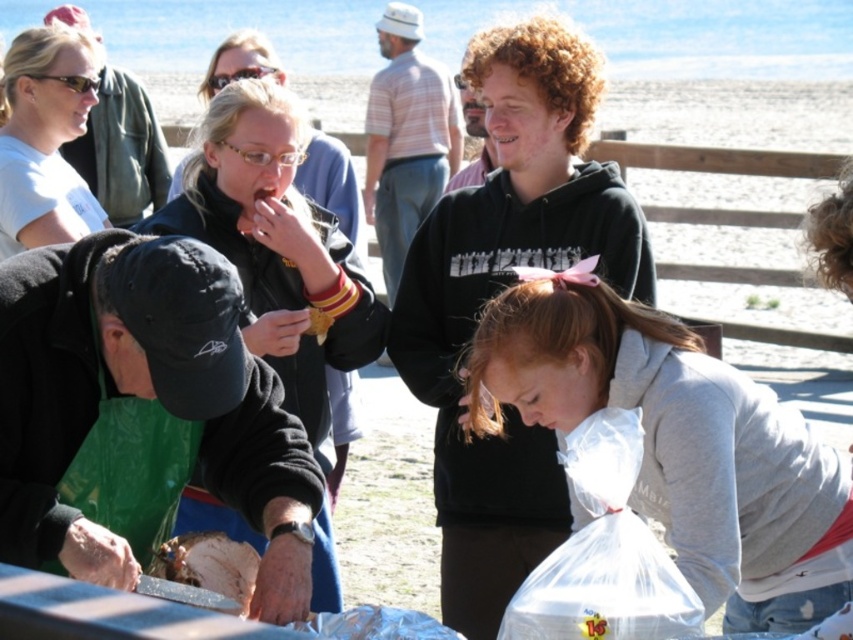
You are a photographer at the beachside gathering. You need to capture a photo that includes both the matte black jacket at center and the shiny silver knife at lower left. Will the knife be visible in the photo if you focus on the jacket?

The matte black jacket at center is above the shiny silver knife at lower left, so if you focus on the jacket, the knife will still be visible in the photo as it is positioned below the jacket.

Based on the photo, you are at the beach gathering and want to find the black hoodie at upper center. The coordinates given are point at (497, 291). Is that point on the black hoodie at upper center?

Yes, the point at (497, 291) is on the black hoodie at upper center.